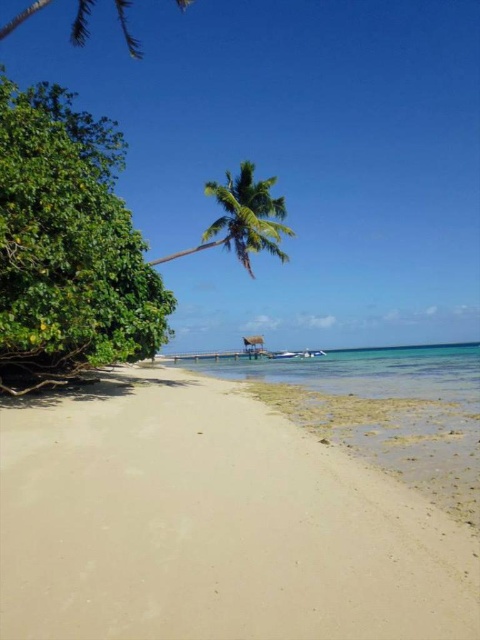
Question: Can you confirm if beige sandy beach at lower left is positioned to the right of clear blue water at center?

Choices:
 (A) no
 (B) yes

Answer: (A)

Question: Which point is farther to the camera?

Choices:
 (A) (331, 362)
 (B) (90, 10)

Answer: (B)

Question: Which object is closer to the camera taking this photo?

Choices:
 (A) green leafy palm tree at center
 (B) beige sandy beach at lower left
 (C) clear blue water at center

Answer: (B)

Question: Is beige sandy beach at lower left closer to camera compared to green leafy palm tree at upper left?

Choices:
 (A) yes
 (B) no

Answer: (A)

Question: Can you confirm if beige sandy beach at lower left is positioned below clear blue water at center?

Choices:
 (A) yes
 (B) no

Answer: (B)

Question: Estimate the real-world distances between objects in this image. Which object is closer to the clear blue water at center?

Choices:
 (A) green leafy palm tree at upper left
 (B) green leafy palm tree at center
 (C) beige sandy beach at lower left

Answer: (B)